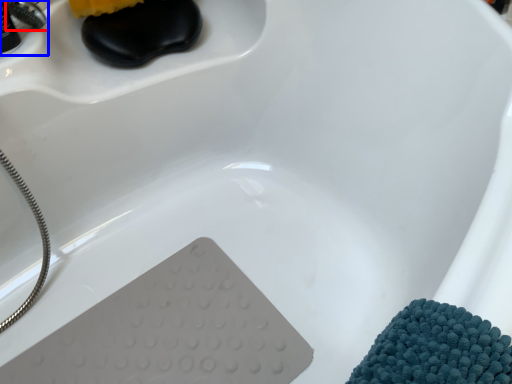
Question: Among these objects, which one is farthest to the camera, faucet (highlighted by a red box) or faucet (highlighted by a blue box)?

Choices:
 (A) faucet
 (B) faucet

Answer: (A)